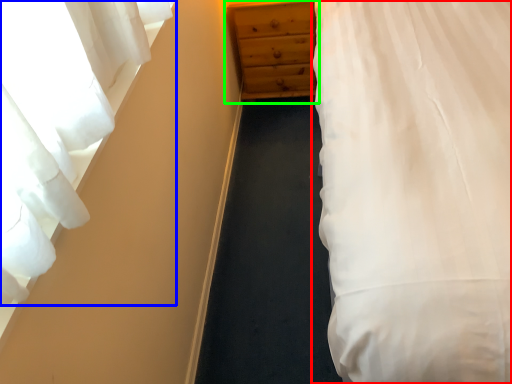
Question: Which object is positioned closest to bed (highlighted by a red box)? Select from curtain (highlighted by a blue box) and chest of drawers (highlighted by a green box).

Choices:
 (A) curtain
 (B) chest of drawers

Answer: (A)